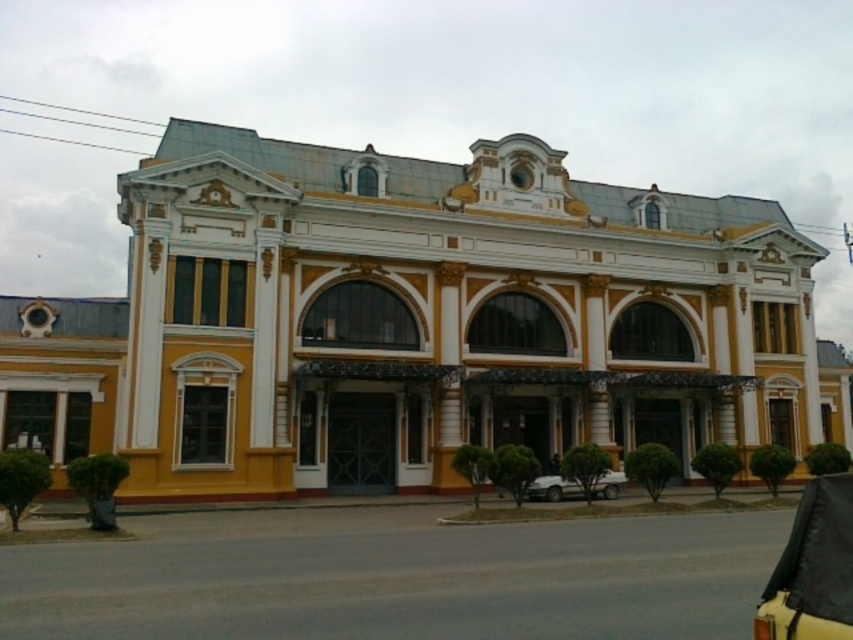
Question: Does yellow matte car at lower right come in front of white matte car at lower center?

Choices:
 (A) yes
 (B) no

Answer: (A)

Question: Can you confirm if yellow matte car at lower right is positioned below white matte car at lower center?

Choices:
 (A) yes
 (B) no

Answer: (B)

Question: Can you confirm if yellow matte car at lower right is smaller than white matte car at lower center?

Choices:
 (A) no
 (B) yes

Answer: (A)

Question: Which point is farther to the camera?

Choices:
 (A) yellow matte car at lower right
 (B) white matte car at lower center

Answer: (B)